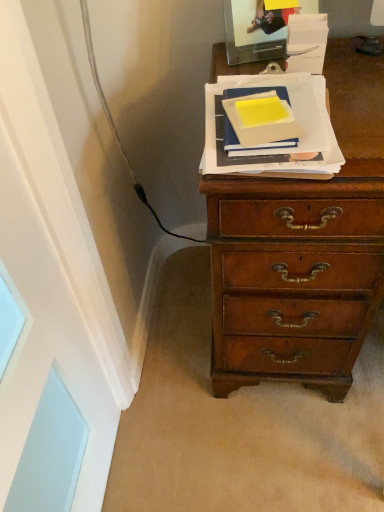
At what (x,y) coordinates should I click in order to perform the action: click on free space in front of matte yellow paper at upper center, placed as the first paperback book when sorted from left to right. Please return your answer as a coordinate pair (x, y). The width and height of the screenshot is (384, 512). Looking at the image, I should click on (278, 157).